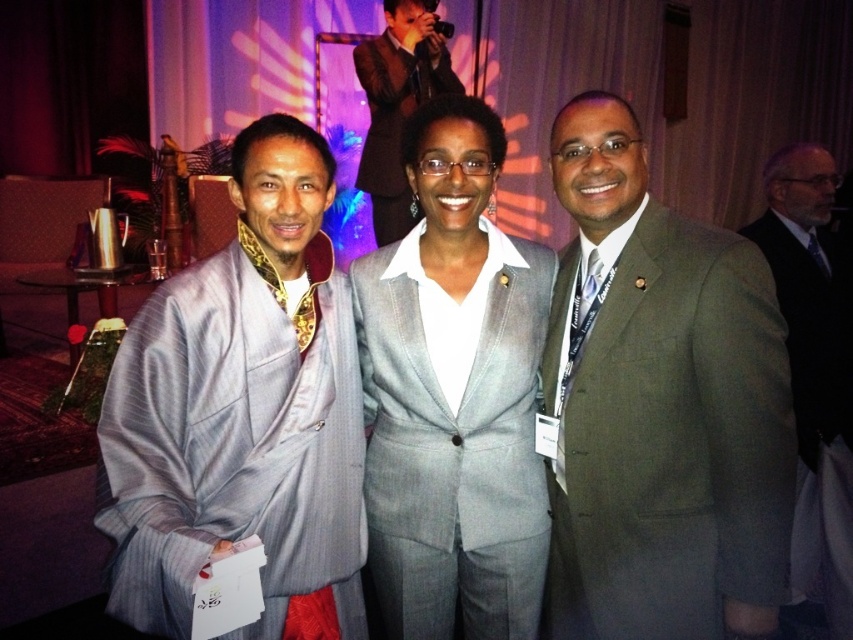
You are a GUI agent. You are given a task and a screenshot of the screen. Output one action in this format:
    pyautogui.click(x=<x>, y=<y>)
    Task: Click on the silky gray robe at center
    The image size is (853, 640).
    Given the screenshot: What is the action you would take?
    pyautogui.click(x=242, y=412)

Is silky gray robe at center smaller than black silk tie at right?

No.

Which is in front, point (265, 380) or point (817, 266)?

Positioned in front is point (265, 380).

You are a GUI agent. You are given a task and a screenshot of the screen. Output one action in this format:
    pyautogui.click(x=<x>, y=<y>)
    Task: Click on the silky gray robe at center
    The width and height of the screenshot is (853, 640).
    Given the screenshot: What is the action you would take?
    pyautogui.click(x=242, y=412)

Can you confirm if black wool suit at right is shorter than brown textured suit at upper center?

In fact, black wool suit at right may be taller than brown textured suit at upper center.

Between black wool suit at right and brown textured suit at upper center, which one has less height?

Standing shorter between the two is brown textured suit at upper center.

Is point (799, 161) closer to camera compared to point (374, 188)?

Yes, point (799, 161) is closer to viewer.

Identify the location of black wool suit at right. The height and width of the screenshot is (640, 853). (811, 372).

Between brown textured suit at upper center and silky blue tie at right, which one is positioned lower?

silky blue tie at right is below.

The image size is (853, 640). Describe the element at coordinates (397, 104) in the screenshot. I see `brown textured suit at upper center` at that location.

Between point (399, 237) and point (579, 326), which one is positioned behind?

The point (399, 237) is behind.

Image resolution: width=853 pixels, height=640 pixels. Find the location of `brown textured suit at upper center`. brown textured suit at upper center is located at coordinates (397, 104).